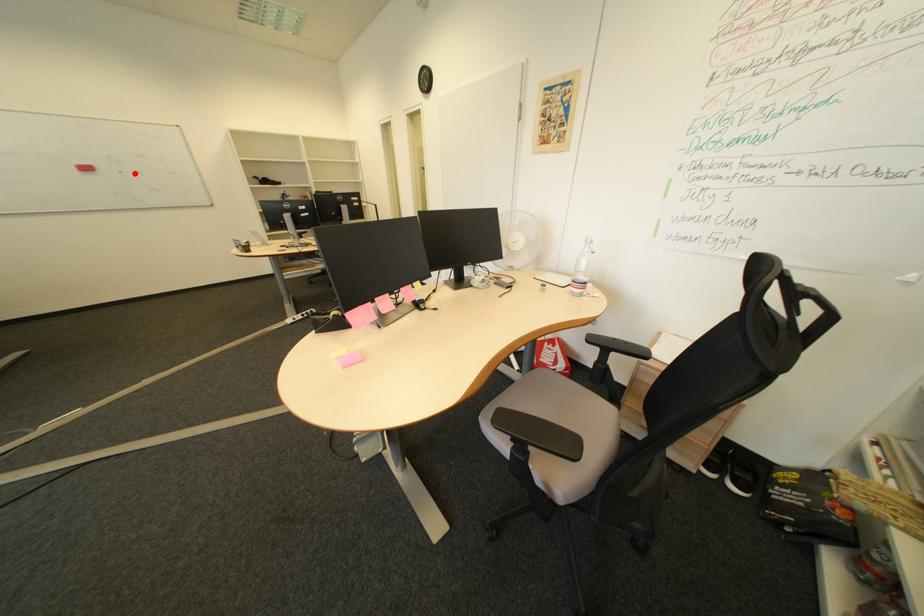
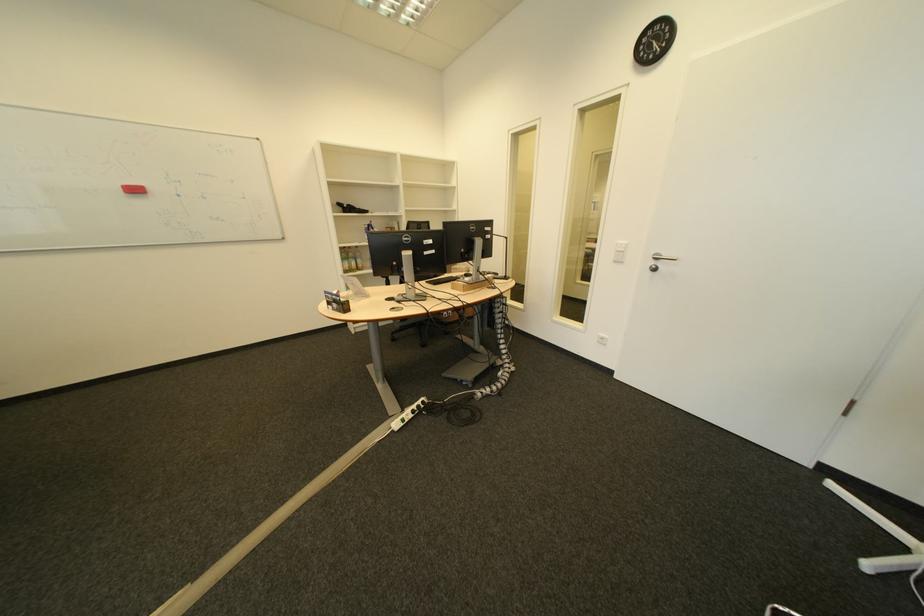
Question: I am providing you with two images of the same scene from different viewpoints. A red point is marked on the first image. Can you still see the location of the red point in image 2?

Choices:
 (A) Yes
 (B) No

Answer: (A)